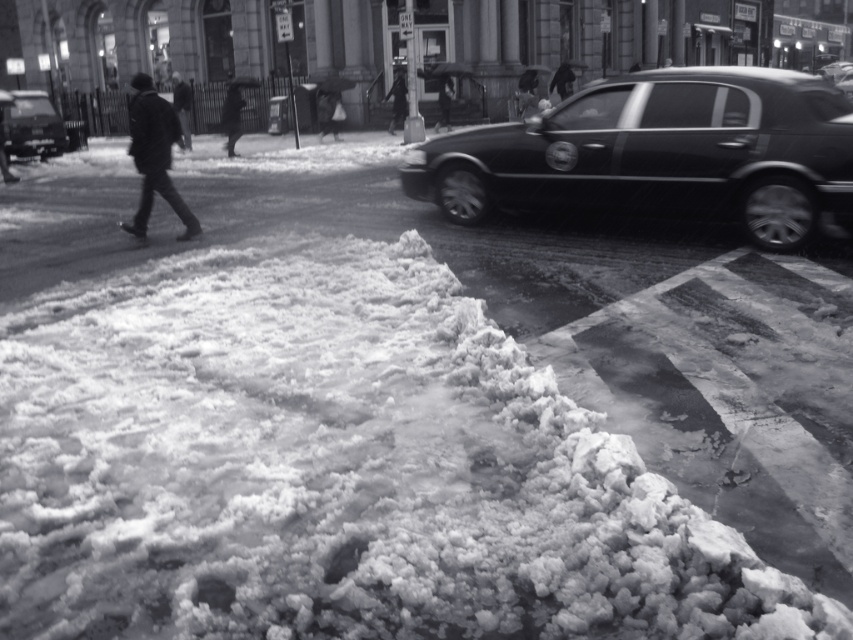
Who is shorter, dark wool coat at left or shiny black car at left?

dark wool coat at left

Between dark wool coat at left and shiny black car at left, which one is positioned lower?

Positioned lower is dark wool coat at left.

Which is behind, point (136, 116) or point (53, 147)?

The point (53, 147) is behind.

At what (x,y) coordinates should I click in order to perform the action: click on dark wool coat at left. Please return your answer as a coordinate pair (x, y). The image size is (853, 640). Looking at the image, I should click on (154, 156).

Can you confirm if shiny black sedan at right is bigger than dark wool coat at left?

Indeed, shiny black sedan at right has a larger size compared to dark wool coat at left.

Does shiny black sedan at right lie in front of dark wool coat at left?

Yes, shiny black sedan at right is in front of dark wool coat at left.

Identify the location of shiny black sedan at right. Image resolution: width=853 pixels, height=640 pixels. (660, 152).

Can you confirm if shiny black sedan at right is positioned above shiny black car at left?

→ Incorrect, shiny black sedan at right is not positioned above shiny black car at left.

Is shiny black sedan at right to the right of shiny black car at left from the viewer's perspective?

Indeed, shiny black sedan at right is positioned on the right side of shiny black car at left.

Is point (735, 81) behind point (64, 132)?

That is False.

Locate an element on the screen. This screenshot has width=853, height=640. shiny black sedan at right is located at coordinates (x=660, y=152).